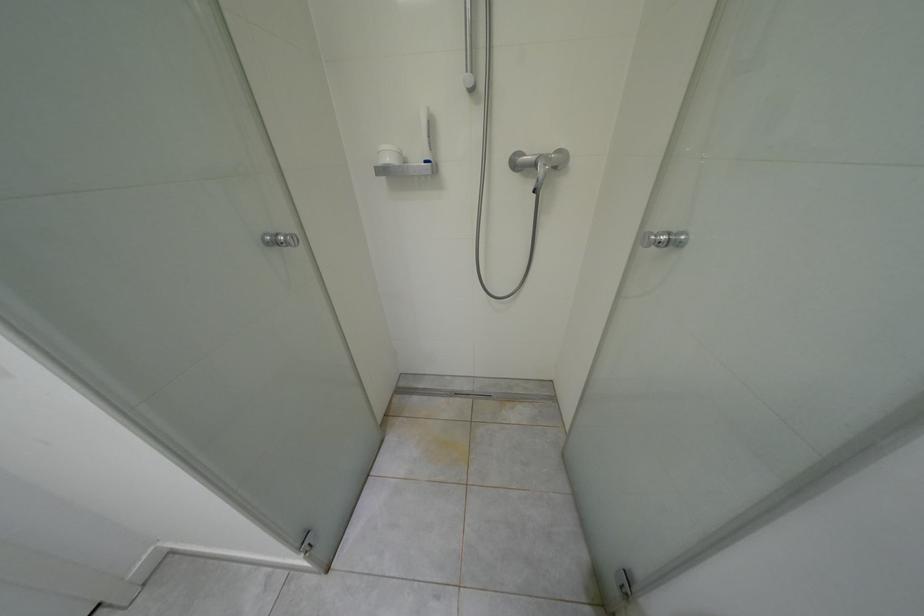
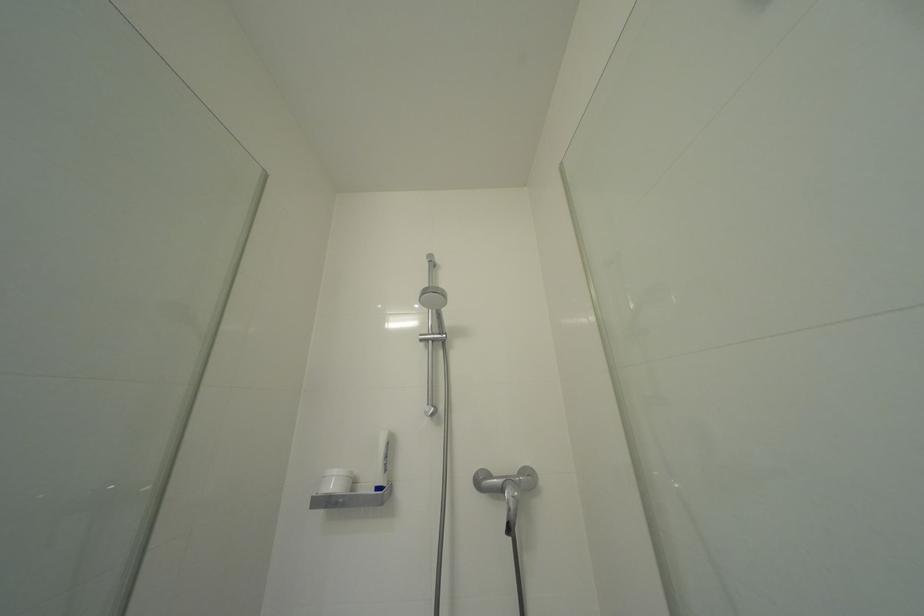
Question: How did the camera likely rotate?

Choices:
 (A) Left
 (B) Right
 (C) Up
 (D) Down

Answer: (C)